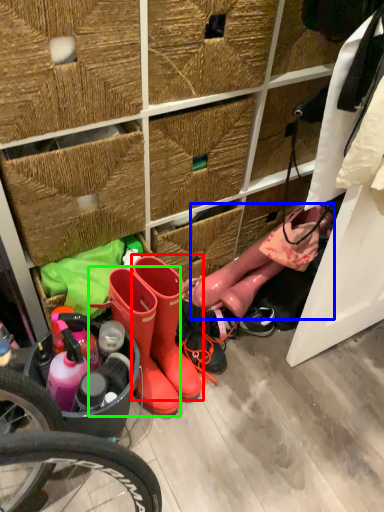
Question: Which is nearer to the footwear (highlighted by a red box)? footwear (highlighted by a blue box) or footwear (highlighted by a green box).

Choices:
 (A) footwear
 (B) footwear

Answer: (B)